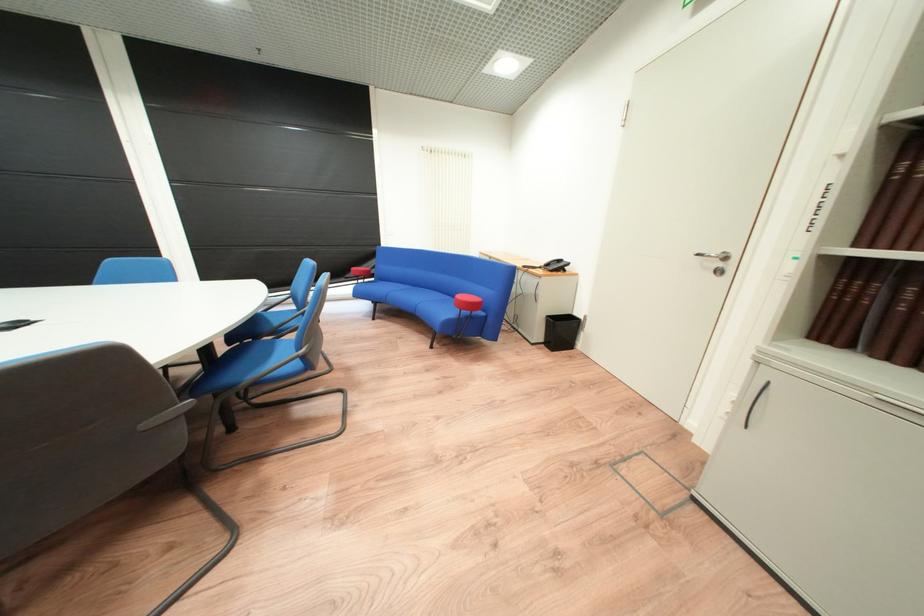
What do you see at coordinates (398, 291) in the screenshot? I see `the blue sofa sitting surface` at bounding box center [398, 291].